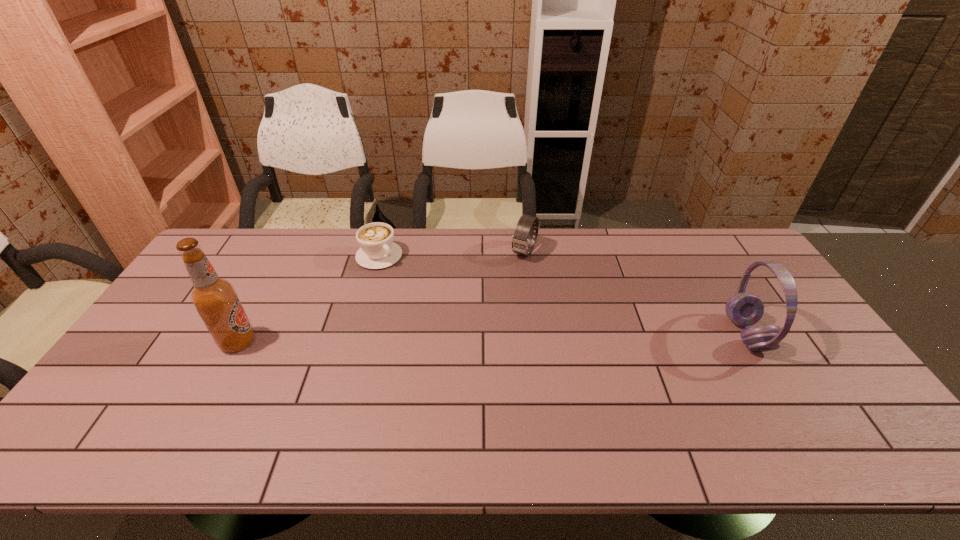
You are a GUI agent. You are given a task and a screenshot of the screen. Output one action in this format:
    pyautogui.click(x=<x>, y=<y>)
    Task: Click on the free area in between the beer bottle and the third shortest object
    The width and height of the screenshot is (960, 540).
    Given the screenshot: What is the action you would take?
    pyautogui.click(x=492, y=338)

Identify the location of free space between the watch and the beer bottle. (381, 297).

Locate an element on the screen. The height and width of the screenshot is (540, 960). unoccupied position between the third object from left to right and the shortest object is located at coordinates (452, 254).

This screenshot has width=960, height=540. Identify the location of vacant space that is in between the third tallest object and the cappuccino. (452, 254).

You are a GUI agent. You are given a task and a screenshot of the screen. Output one action in this format:
    pyautogui.click(x=<x>, y=<y>)
    Task: Click on the free space between the cappuccino and the second shortest object
    
    Given the screenshot: What is the action you would take?
    pyautogui.click(x=452, y=254)

You are a GUI agent. You are given a task and a screenshot of the screen. Output one action in this format:
    pyautogui.click(x=<x>, y=<y>)
    Task: Click on the empty space that is in between the second object from left to right and the tallest object
    This screenshot has height=540, width=960.
    Given the screenshot: What is the action you would take?
    pyautogui.click(x=309, y=299)

This screenshot has height=540, width=960. I want to click on free space between the cappuccino and the watch, so click(x=452, y=254).

Identify which object is the closest to the headset. Please provide its 2D coordinates. Your answer should be formatted as a tuple, i.e. [(x, y)], where the tuple contains the x and y coordinates of a point satisfying the conditions above.

[(522, 239)]

Select which object is the third closest to the third tallest object. Please provide its 2D coordinates. Your answer should be formatted as a tuple, i.e. [(x, y)], where the tuple contains the x and y coordinates of a point satisfying the conditions above.

[(215, 299)]

In order to click on vacant region that satisfies the following two spatial constraints: 1. on the front side of the watch; 2. on the headband and ear cups of the second tallest object in this screenshot , I will do click(x=535, y=334).